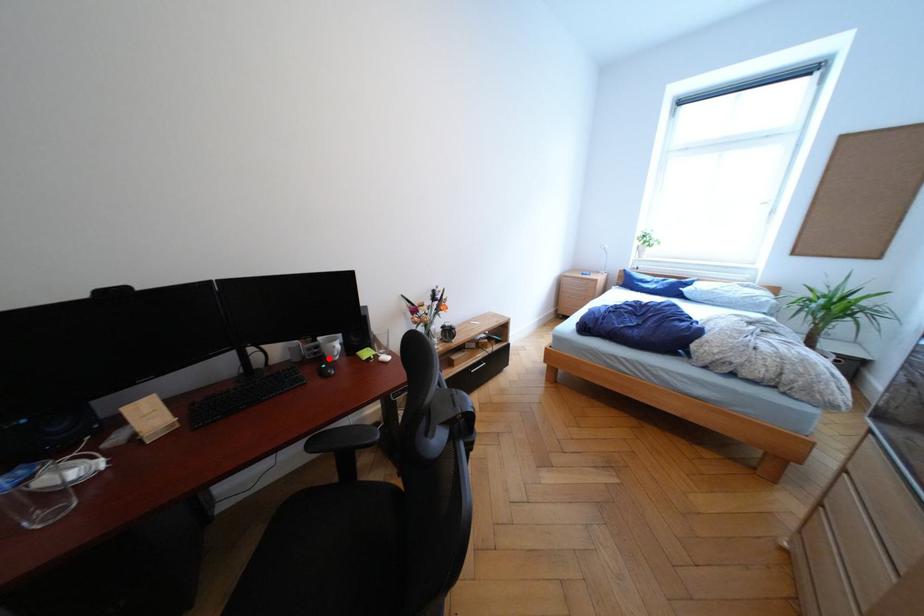
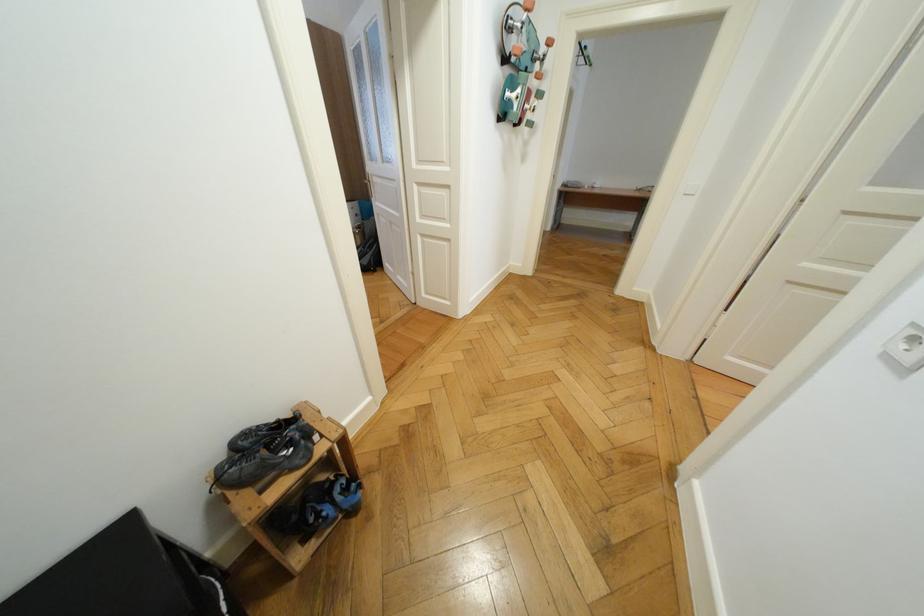
Question: I am providing you with two images of the same scene from different viewpoints. A red point is marked on the first image. At the location where the point appears in image 1, is it still visible in image 2?

Choices:
 (A) Yes
 (B) No

Answer: (B)